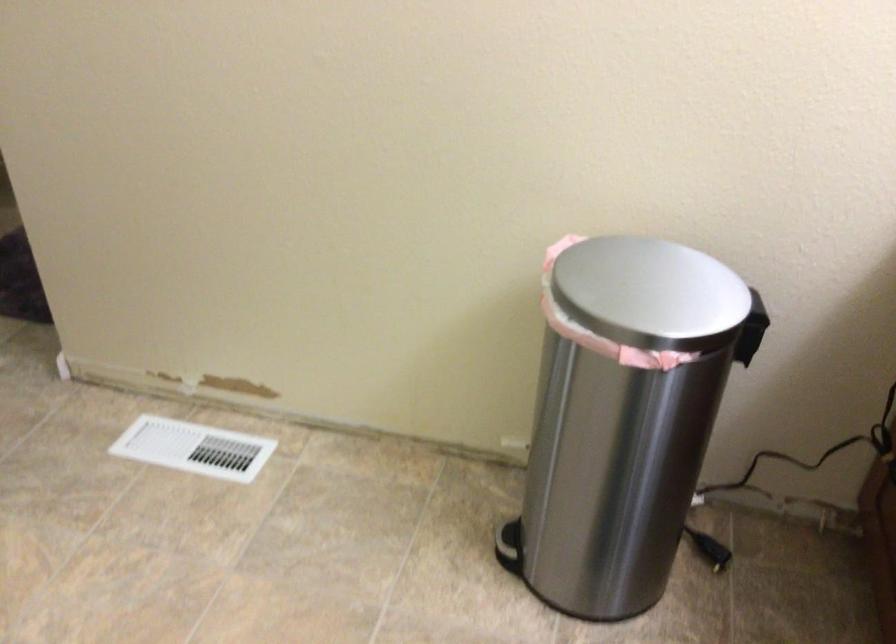
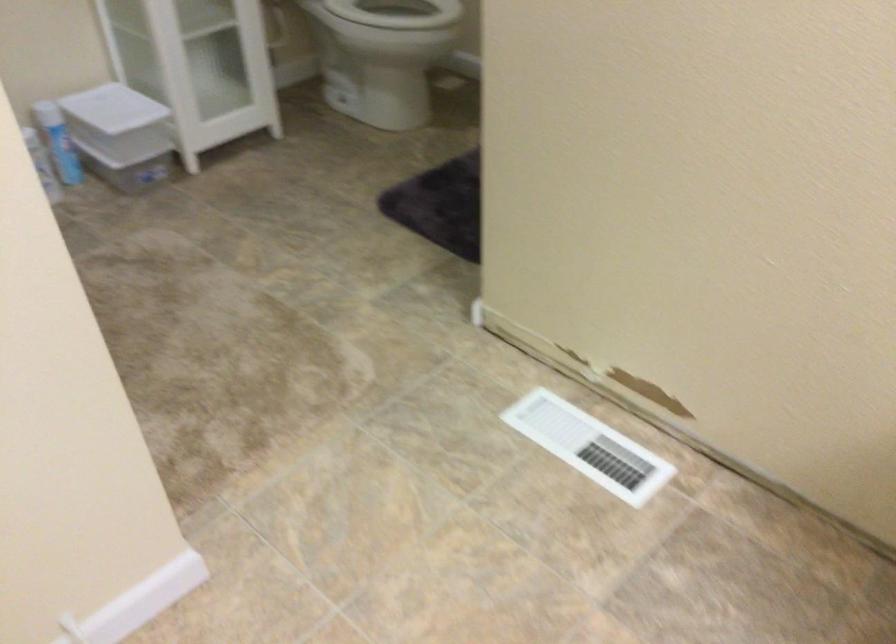
Question: How did the camera likely rotate?

Choices:
 (A) Left
 (B) Right
 (C) Up
 (D) Down

Answer: (A)